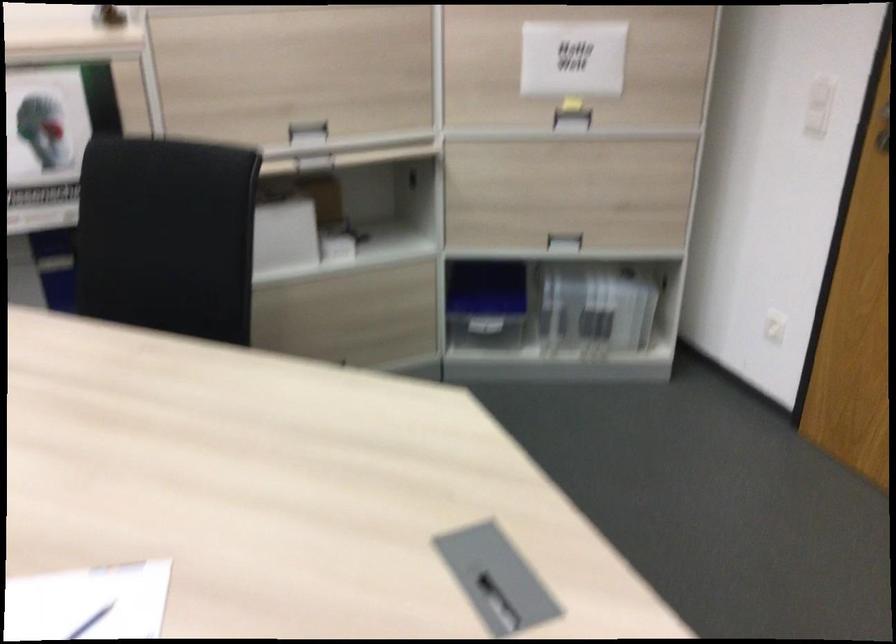
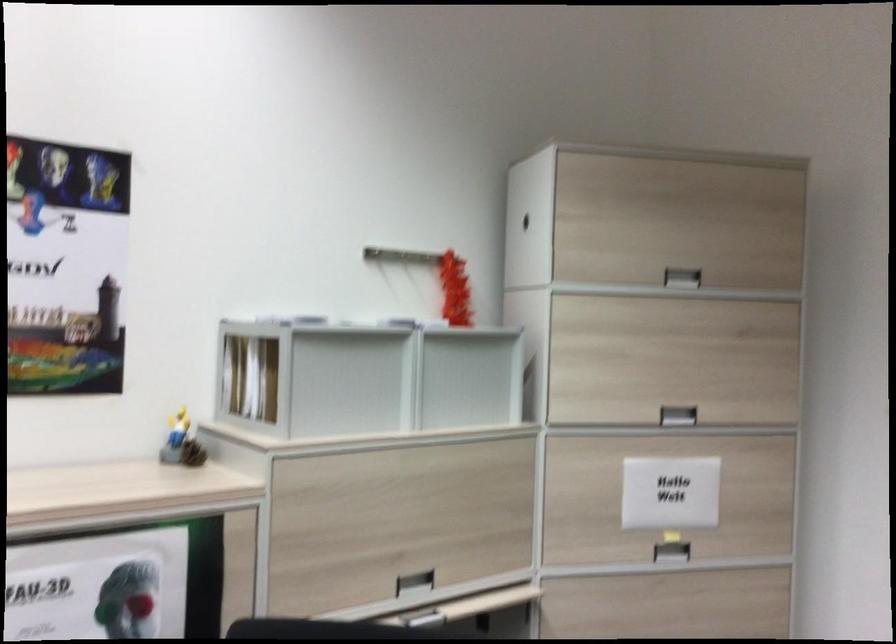
The images are taken continuously from a first-person perspective. In which direction are you moving?

The cameraman walked toward left, forward.